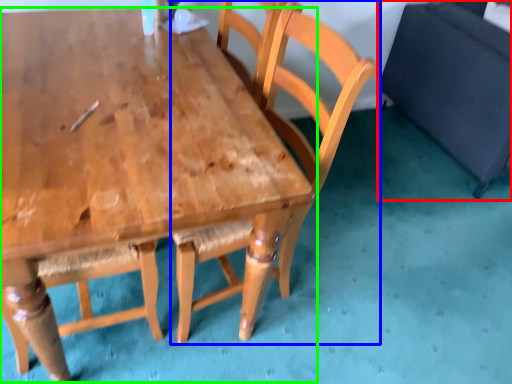
Question: Considering the real-world distances, which object is closest to swivel chair (highlighted by a red box)? chair (highlighted by a blue box) or table (highlighted by a green box).

Choices:
 (A) chair
 (B) table

Answer: (A)